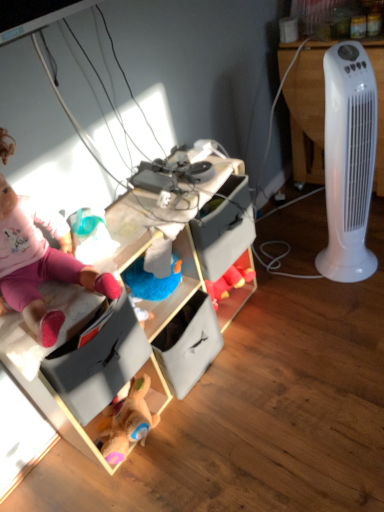
Where is `vacant area that lies in front of white plastic tower fan at right`? The image size is (384, 512). vacant area that lies in front of white plastic tower fan at right is located at coordinates (352, 301).